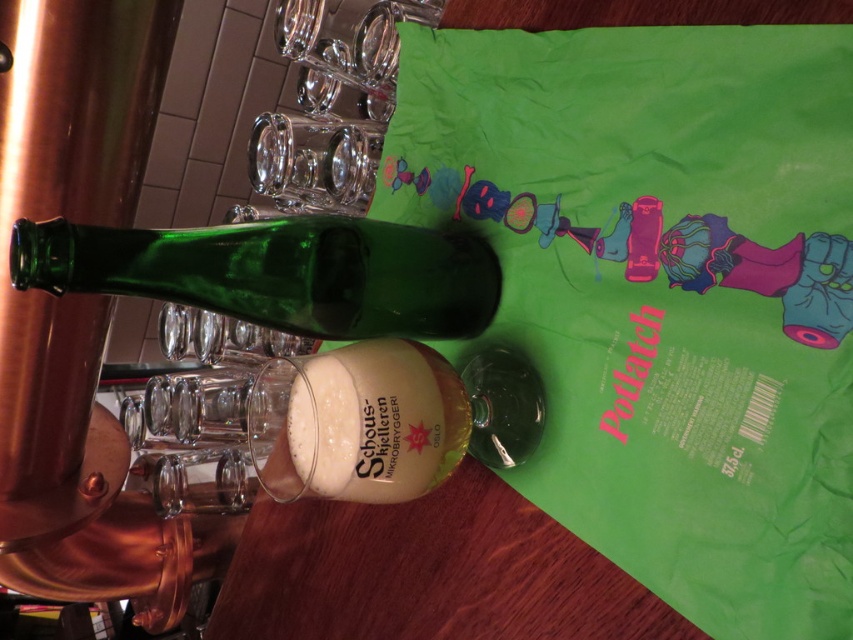
Question: Can you confirm if green glass bottle at center is positioned to the right of translucent glass mug at center?

Choices:
 (A) no
 (B) yes

Answer: (A)

Question: Which object is the farthest from the translucent glass mug at center?

Choices:
 (A) green glass bottle at center
 (B) transparent glass at upper center

Answer: (B)

Question: Can you confirm if green glass bottle at center is positioned below transparent glass at upper center?

Choices:
 (A) no
 (B) yes

Answer: (B)

Question: Among these points, which one is nearest to the camera?

Choices:
 (A) (380, 125)
 (B) (323, 426)
 (C) (16, 282)

Answer: (C)

Question: Estimate the real-world distances between objects in this image. Which object is farther from the transparent glass at upper center?

Choices:
 (A) green glass bottle at center
 (B) translucent glass mug at center

Answer: (B)

Question: Does translucent glass mug at center appear over transparent glass at upper center?

Choices:
 (A) yes
 (B) no

Answer: (B)